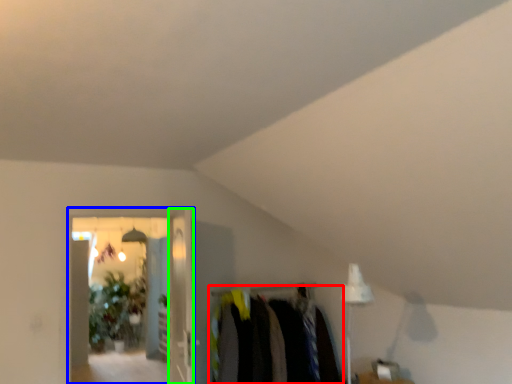
Question: Estimate the real-world distances between objects in this image. Which object is closer to closet (highlighted by a red box), glass door (highlighted by a blue box) or glass door (highlighted by a green box)?

Choices:
 (A) glass door
 (B) glass door

Answer: (B)